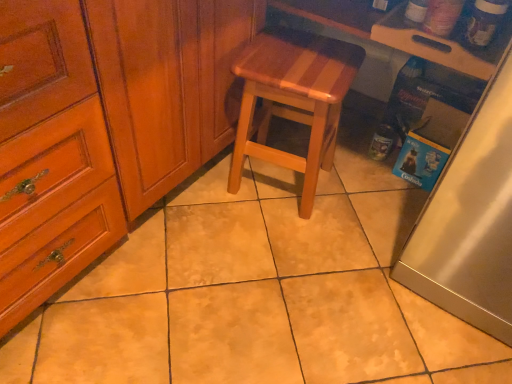
Question: Can you confirm if natural wood stool at center is smaller than satin silver fridge at right?

Choices:
 (A) no
 (B) yes

Answer: (B)

Question: Would you say natural wood stool at center contains satin silver fridge at right?

Choices:
 (A) no
 (B) yes

Answer: (A)

Question: Is natural wood stool at center oriented away from satin silver fridge at right?

Choices:
 (A) no
 (B) yes

Answer: (A)

Question: From the image's perspective, is natural wood stool at center located above satin silver fridge at right?

Choices:
 (A) yes
 (B) no

Answer: (A)

Question: Is natural wood stool at center positioned before satin silver fridge at right?

Choices:
 (A) no
 (B) yes

Answer: (A)

Question: In terms of size, does satin silver fridge at right appear bigger or smaller than wooden cutting board at upper right?

Choices:
 (A) big
 (B) small

Answer: (A)

Question: Is satin silver fridge at right situated inside wooden cutting board at upper right or outside?

Choices:
 (A) inside
 (B) outside

Answer: (B)

Question: Is point (448, 278) positioned closer to the camera than point (322, 16)?

Choices:
 (A) closer
 (B) farther

Answer: (A)

Question: Looking at their shapes, would you say satin silver fridge at right is wider or thinner than wooden cutting board at upper right?

Choices:
 (A) wide
 (B) thin

Answer: (A)

Question: Is point (349, 29) positioned closer to the camera than point (485, 269)?

Choices:
 (A) closer
 (B) farther

Answer: (B)

Question: Visually, is wooden cutting board at upper right positioned to the left or to the right of satin silver fridge at right?

Choices:
 (A) left
 (B) right

Answer: (A)

Question: Which is correct: wooden cutting board at upper right is inside satin silver fridge at right, or outside of it?

Choices:
 (A) outside
 (B) inside

Answer: (A)

Question: Based on their sizes in the image, would you say wooden cutting board at upper right is bigger or smaller than satin silver fridge at right?

Choices:
 (A) big
 (B) small

Answer: (B)

Question: Choose the correct answer: Is satin silver fridge at right inside natural wood stool at center or outside it?

Choices:
 (A) inside
 (B) outside

Answer: (B)

Question: Considering the positions of satin silver fridge at right and natural wood stool at center in the image, is satin silver fridge at right taller or shorter than natural wood stool at center?

Choices:
 (A) tall
 (B) short

Answer: (A)